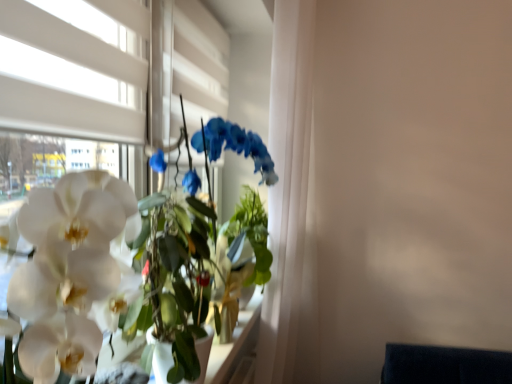
Question: Considering the positions of white glossy orchid at left and white matte window at upper left in the image, is white glossy orchid at left wider or thinner than white matte window at upper left?

Choices:
 (A) wide
 (B) thin

Answer: (A)

Question: In the image, is white glossy orchid at left on the left side or the right side of white matte window at upper left?

Choices:
 (A) left
 (B) right

Answer: (B)

Question: Considering the positions of point (170, 294) and point (52, 86), is point (170, 294) closer or farther from the camera than point (52, 86)?

Choices:
 (A) farther
 (B) closer

Answer: (A)

Question: Is white matte window at upper left to the left or to the right of white glossy orchid at left in the image?

Choices:
 (A) left
 (B) right

Answer: (A)

Question: From a real-world perspective, is white matte window at upper left physically located above or below white glossy orchid at left?

Choices:
 (A) below
 (B) above

Answer: (B)

Question: Do you think white matte window at upper left is within white glossy orchid at left, or outside of it?

Choices:
 (A) inside
 (B) outside

Answer: (B)

Question: Does point (35, 49) appear closer or farther from the camera than point (68, 331)?

Choices:
 (A) closer
 (B) farther

Answer: (B)